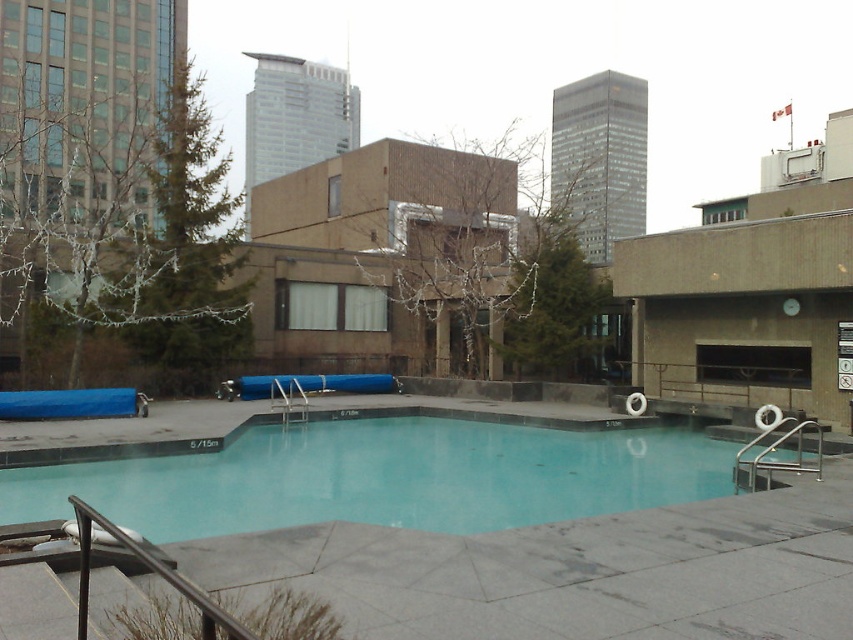
You are standing at the entrance of the pool area and want to locate the clear glass pool at center. According to the coordinates provided, where should you look relative to the entrance?

The clear glass pool at center is located at coordinates point (381, 477), which would be to the right and slightly forward from the entrance.